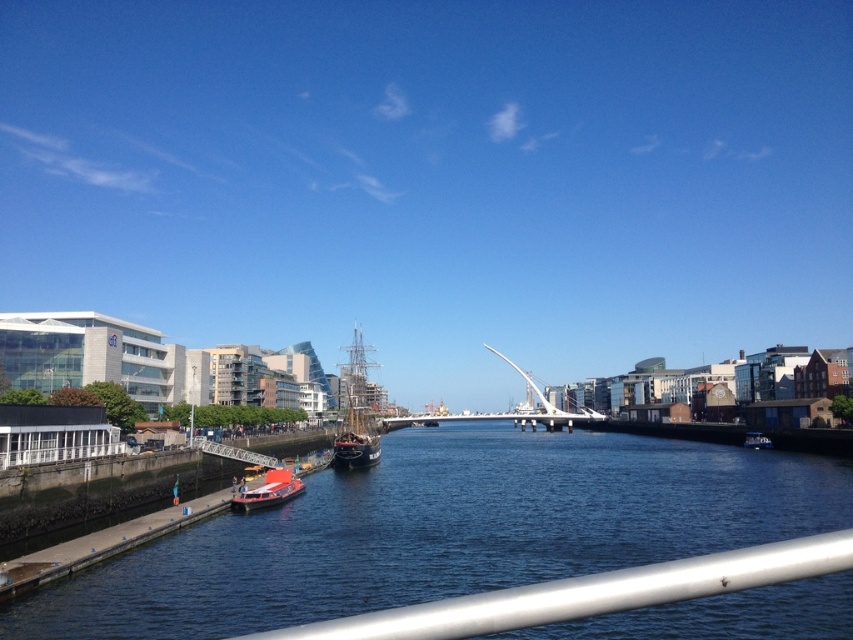
Can you confirm if blue water at lower left is positioned below white metallic bridge at center?

No, blue water at lower left is not below white metallic bridge at center.

Looking at this image, can you confirm if blue water at lower left is positioned to the left of white metallic bridge at center?

Incorrect, blue water at lower left is not on the left side of white metallic bridge at center.

You are a GUI agent. You are given a task and a screenshot of the screen. Output one action in this format:
    pyautogui.click(x=<x>, y=<y>)
    Task: Click on the blue water at lower left
    This screenshot has height=640, width=853.
    Given the screenshot: What is the action you would take?
    pyautogui.click(x=445, y=531)

Where is `blue water at lower left`? The image size is (853, 640). blue water at lower left is located at coordinates (445, 531).

Is silver metallic railing at lower center closer to the viewer compared to white metallic bridge at center?

Yes, it is.

Is point (763, 580) farther from viewer compared to point (563, 426)?

No, it is in front of (563, 426).

You are a GUI agent. You are given a task and a screenshot of the screen. Output one action in this format:
    pyautogui.click(x=<x>, y=<y>)
    Task: Click on the silver metallic railing at lower center
    
    Given the screenshot: What is the action you would take?
    pyautogui.click(x=589, y=593)

Locate an element on the screen. silver metallic railing at lower center is located at coordinates (589, 593).

Is white metallic bridge at center taller than red matte boat at lower left?

Indeed, white metallic bridge at center has a greater height compared to red matte boat at lower left.

Image resolution: width=853 pixels, height=640 pixels. What do you see at coordinates (500, 419) in the screenshot?
I see `white metallic bridge at center` at bounding box center [500, 419].

Which is behind, point (477, 413) or point (282, 468)?

Point (477, 413)

The image size is (853, 640). In order to click on white metallic bridge at center in this screenshot , I will do `click(500, 419)`.